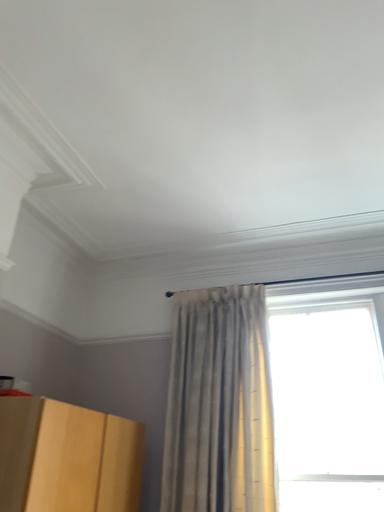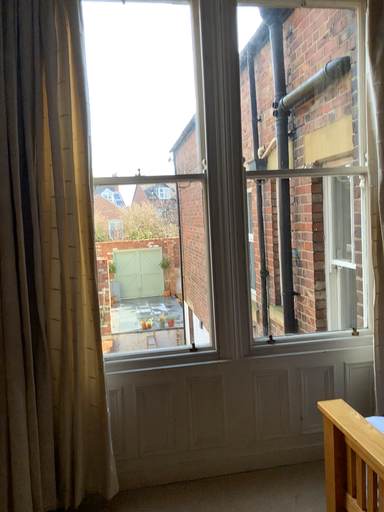
Question: How did the camera likely rotate when shooting the video?

Choices:
 (A) rotated downward
 (B) rotated upward

Answer: (A)